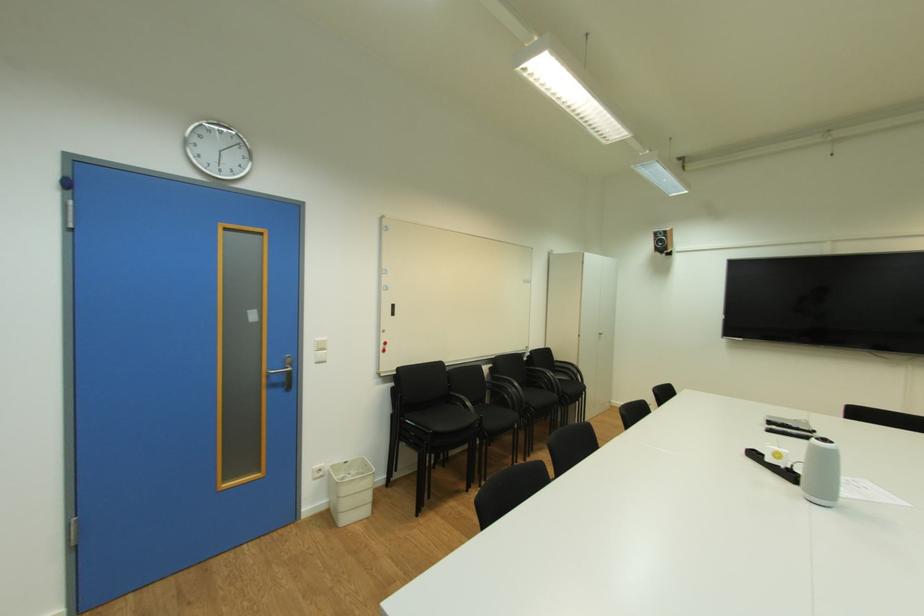
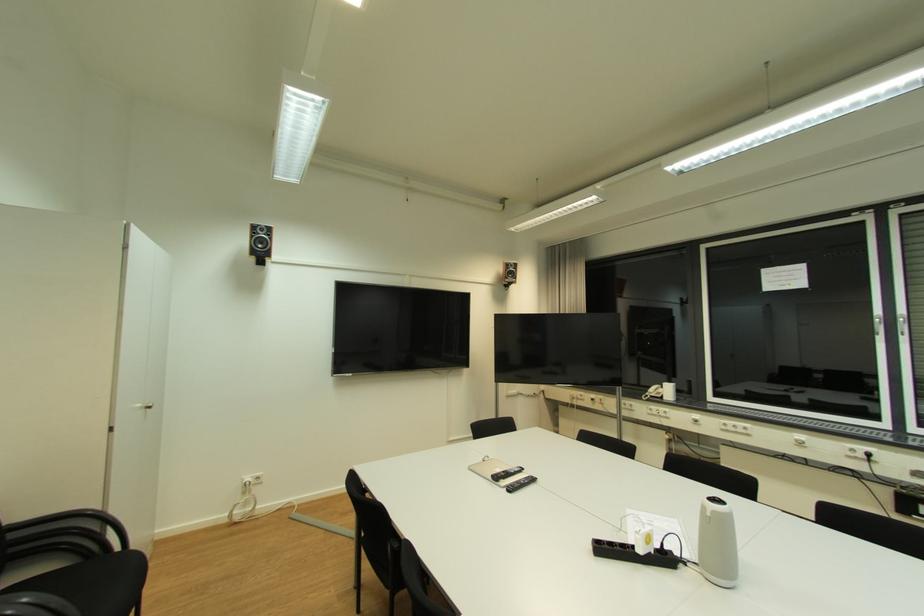
Find the pixel in the second image that matches pixel 661 235 in the first image.

(261, 228)